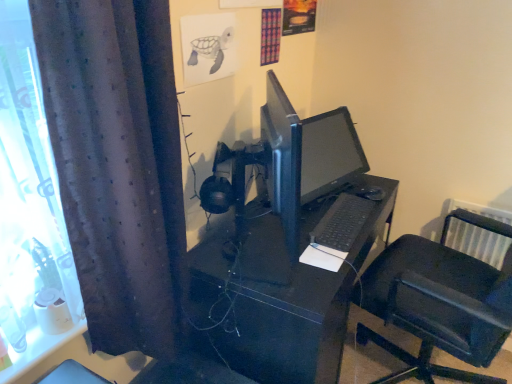
Where is `free space below black matte keyboard at center (from a real-world perspective)`? This screenshot has height=384, width=512. free space below black matte keyboard at center (from a real-world perspective) is located at coordinates (338, 218).